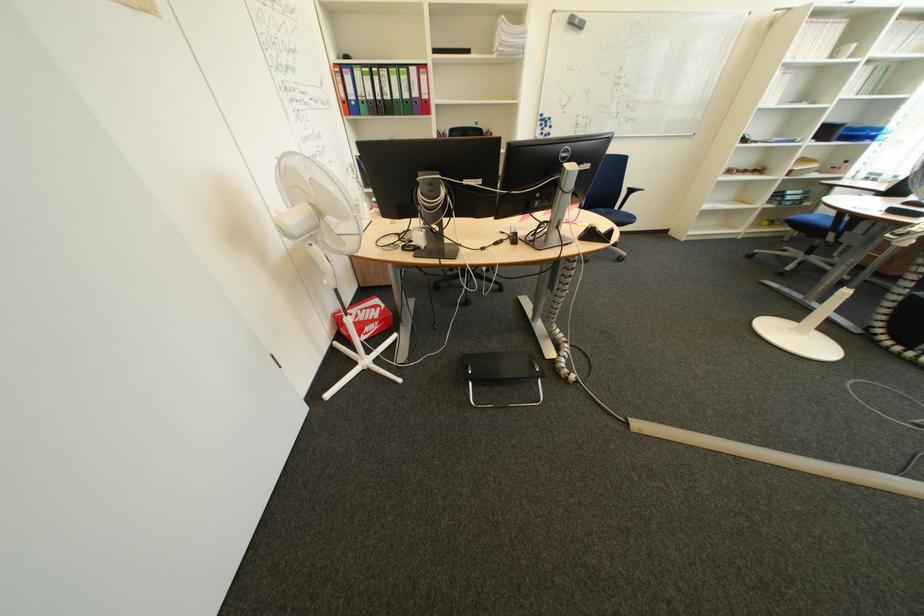
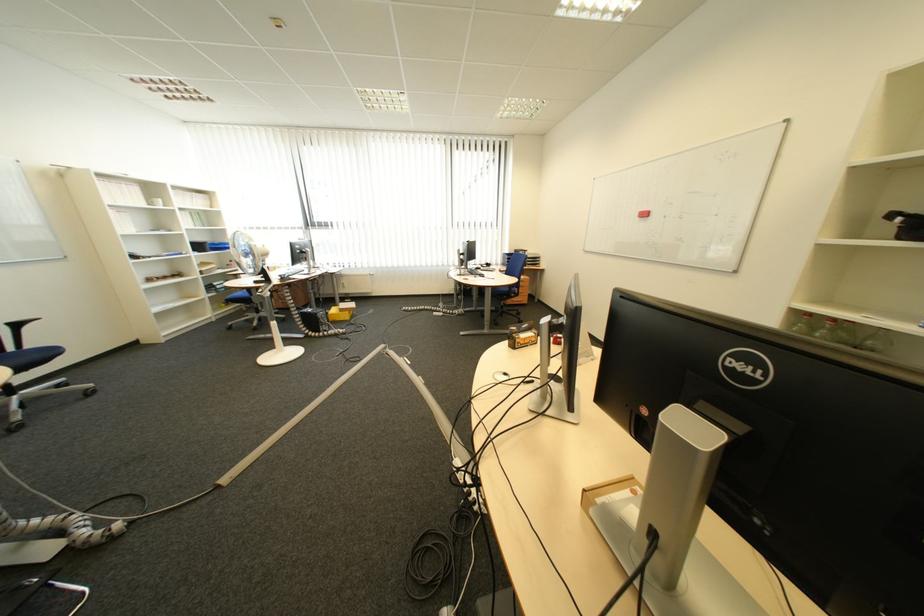
Find the pixel in the second image that matches [640,185] in the first image.

(13, 321)